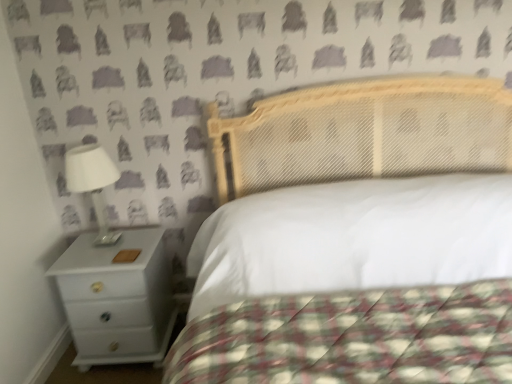
Where is `white glossy lamp at left`? white glossy lamp at left is located at coordinates (92, 182).

What do you see at coordinates (364, 133) in the screenshot?
I see `white quilted fabric at center` at bounding box center [364, 133].

Identify the location of white glossy nightstand at lower left. The image size is (512, 384). (117, 298).

The width and height of the screenshot is (512, 384). There is a white glossy nightstand at lower left. What are the coordinates of `bed above it (from a real-world perspective)` in the screenshot? It's located at (364, 133).

Is white glossy nightstand at lower left facing away from white quilted fabric at center?

No, white quilted fabric at center is not at the back of white glossy nightstand at lower left.

From the image's perspective, is white glossy nightstand at lower left above or below white quilted fabric at center?

white glossy nightstand at lower left is situated lower than white quilted fabric at center in the image.

Does point (134, 268) lie behind point (310, 154)?

No.

Is white quilted fabric at center not close to white glossy lamp at left?

white quilted fabric at center is actually quite close to white glossy lamp at left.

Is white quilted fabric at center located outside white glossy lamp at left?

Yes, white quilted fabric at center is not within white glossy lamp at left.

From the image's perspective, is white quilted fabric at center above or below white glossy lamp at left?

Clearly, from the image's perspective, white quilted fabric at center is below white glossy lamp at left.

Between white glossy lamp at left and white glossy nightstand at lower left, which one is positioned behind?

white glossy nightstand at lower left is further from the camera.

From a real-world perspective, between white glossy lamp at left and white glossy nightstand at lower left, who is vertically lower?

In real-world perspective, white glossy nightstand at lower left is lower.

Is white glossy nightstand at lower left completely or partially inside white glossy lamp at left?

No, white glossy nightstand at lower left is not surrounded by white glossy lamp at left.

Does white glossy nightstand at lower left have a lesser height compared to white glossy lamp at left?

Incorrect, the height of white glossy nightstand at lower left does not fall short of that of white glossy lamp at left.

Looking at this image, is there a large distance between white glossy nightstand at lower left and white glossy lamp at left?

No, white glossy nightstand at lower left is not far away from white glossy lamp at left.

Is white glossy nightstand at lower left inside the boundaries of white glossy lamp at left, or outside?

white glossy nightstand at lower left is spatially situated outside white glossy lamp at left.

How many degrees apart are the facing directions of white glossy nightstand at lower left and white glossy lamp at left?

They differ by 1.54 degrees in their facing directions.

From a real-world perspective, which object rests below the other?

In real-world perspective, white quilted fabric at center is lower.

Considering the relative positions of white glossy lamp at left and white quilted fabric at center in the image provided, is white glossy lamp at left to the left of white quilted fabric at center from the viewer's perspective?

Yes, white glossy lamp at left is to the left of white quilted fabric at center.

From the image's perspective, which is below, white glossy lamp at left or white quilted fabric at center?

From the image's view, white quilted fabric at center is below.

From the image's perspective, is white quilted fabric at center located above or below white glossy nightstand at lower left?

From the image's perspective, white quilted fabric at center appears above white glossy nightstand at lower left.

Is white quilted fabric at center facing away from white glossy nightstand at lower left?

No, white quilted fabric at center is not facing the opposite direction of white glossy nightstand at lower left.

The width and height of the screenshot is (512, 384). Identify the location of nightstand below the white quilted fabric at center (from a real-world perspective). (117, 298).

From a real-world perspective, is white quilted fabric at center on white glossy nightstand at lower left?

Yes, from a real-world perspective, white quilted fabric at center is over white glossy nightstand at lower left

Find the location of a particular element. Image resolution: width=512 pixels, height=384 pixels. bed on the right of white glossy nightstand at lower left is located at coordinates point(364,133).

You are a GUI agent. You are given a task and a screenshot of the screen. Output one action in this format:
    pyautogui.click(x=<x>, y=<y>)
    Task: Click on the lamp on the left of white quilted fabric at center
    
    Given the screenshot: What is the action you would take?
    pyautogui.click(x=92, y=182)

When comparing their distances from white glossy lamp at left, does white glossy nightstand at lower left or white quilted fabric at center seem closer?

white glossy nightstand at lower left is closer to white glossy lamp at left.

Which object lies nearer to the anchor point white glossy lamp at left, white quilted fabric at center or white glossy nightstand at lower left?

white glossy nightstand at lower left is positioned closer to the anchor white glossy lamp at left.

When comparing their distances from white quilted fabric at center, does white glossy lamp at left or white glossy nightstand at lower left seem further?

white glossy lamp at left lies further to white quilted fabric at center than the other object.

When comparing their distances from white glossy nightstand at lower left, does white quilted fabric at center or white glossy lamp at left seem further?

The object further to white glossy nightstand at lower left is white quilted fabric at center.

Based on their spatial positions, is white glossy nightstand at lower left or white glossy lamp at left closer to white quilted fabric at center?

white glossy nightstand at lower left.

Looking at the image, which one is located further to white glossy nightstand at lower left, white glossy lamp at left or white quilted fabric at center?

Based on the image, white quilted fabric at center appears to be further to white glossy nightstand at lower left.

The height and width of the screenshot is (384, 512). Find the location of `lamp between white quilted fabric at center and white glossy nightstand at lower left in the front-back direction`. lamp between white quilted fabric at center and white glossy nightstand at lower left in the front-back direction is located at coordinates (92, 182).